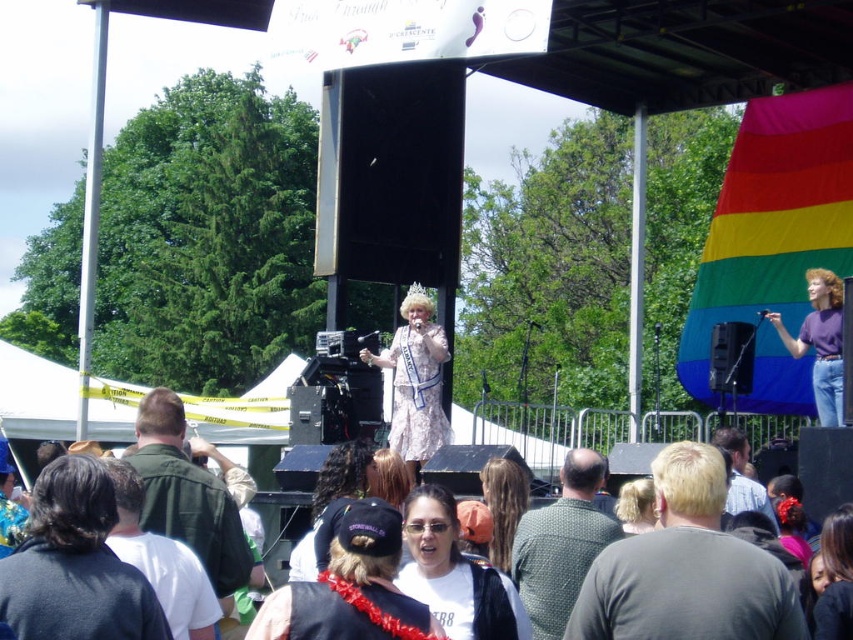
Question: Which is nearer to the green matte jacket at left?

Choices:
 (A) gray fabric shirt at center
 (B) white lace dress at center
 (C) long brown hair at center

Answer: (C)

Question: Where is white lace dress at center located in relation to shiny brown hair at center in the image?

Choices:
 (A) left
 (B) right

Answer: (B)

Question: Considering the real-world distances, which object is farthest from the gray fabric shirt at center?

Choices:
 (A) white matte t-shirt at center
 (B) green matte jacket at left
 (C) dark brown hair at lower left

Answer: (C)

Question: Observing the image, what is the correct spatial positioning of white matte t-shirt at center in reference to blonde hair at center?

Choices:
 (A) above
 (B) below

Answer: (B)

Question: Is long brown hair at center to the left of gray fabric shirt at center from the viewer's perspective?

Choices:
 (A) no
 (B) yes

Answer: (B)

Question: Which object is positioned closest to the matte black cap at center?

Choices:
 (A) green dotted shirt at center
 (B) blonde hair at center

Answer: (B)